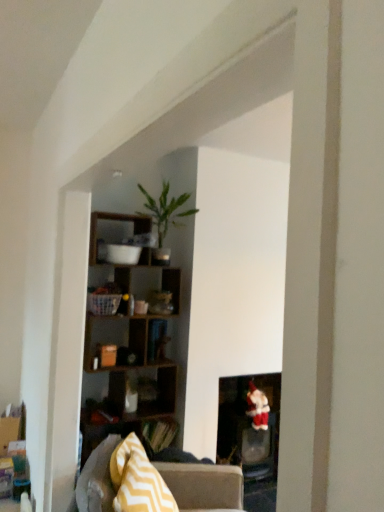
Question: Relative to green matte plant at upper center, is wooden cube shelf at upper center in front or behind?

Choices:
 (A) front
 (B) behind

Answer: (A)

Question: Based on their positions, is wooden cube shelf at upper center located to the left or right of green matte plant at upper center?

Choices:
 (A) left
 (B) right

Answer: (A)

Question: Which of these objects is positioned farthest from the velvet santa at lower right?

Choices:
 (A) green matte plant at upper center
 (B) wooden cube shelf at upper center
 (C) matte black fireplace at lower right
 (D) gray fabric couch at center
 (E) yellow zigzag fabric pillow at lower left

Answer: (E)

Question: Based on their relative distances, which object is nearer to the velvet santa at lower right?

Choices:
 (A) yellow zigzag fabric pillow at lower left
 (B) matte black fireplace at lower right
 (C) green matte plant at upper center
 (D) wooden cube shelf at upper center
 (E) gray fabric couch at center

Answer: (B)